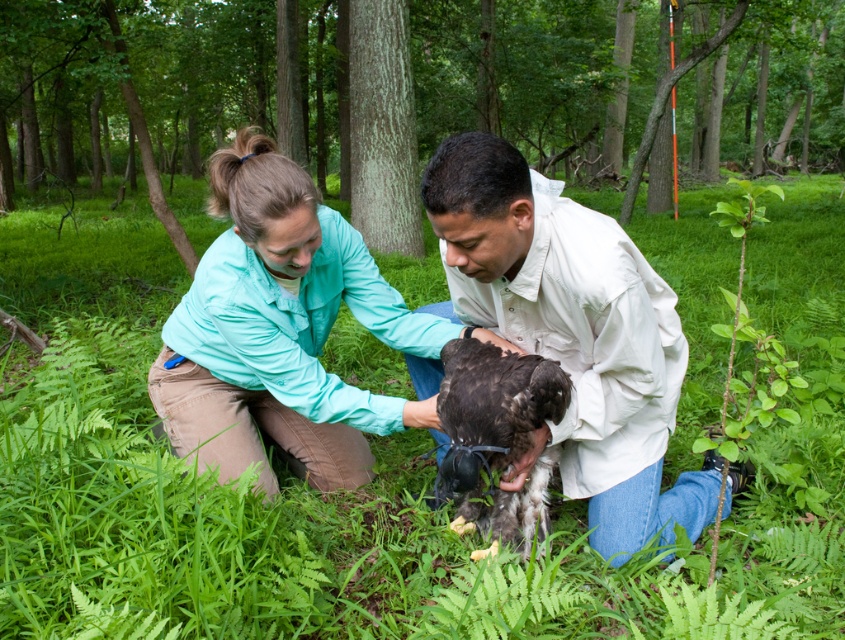
Question: Which point is farther to the camera?

Choices:
 (A) (724, 282)
 (B) (565, 392)

Answer: (A)

Question: Can you confirm if green leafy grass at center is bigger than teal fabric shirt at center?

Choices:
 (A) yes
 (B) no

Answer: (A)

Question: Which point is closer to the camera?

Choices:
 (A) (627, 525)
 (B) (478, 467)
 (C) (771, 264)

Answer: (B)

Question: Is white matte shirt at center further to camera compared to teal fabric shirt at center?

Choices:
 (A) no
 (B) yes

Answer: (A)

Question: Which point is farther to the camera?

Choices:
 (A) dark brown feathered eagle at center
 (B) green leafy grass at center

Answer: (A)

Question: Can you confirm if green leafy grass at center is wider than teal fabric shirt at center?

Choices:
 (A) no
 (B) yes

Answer: (B)